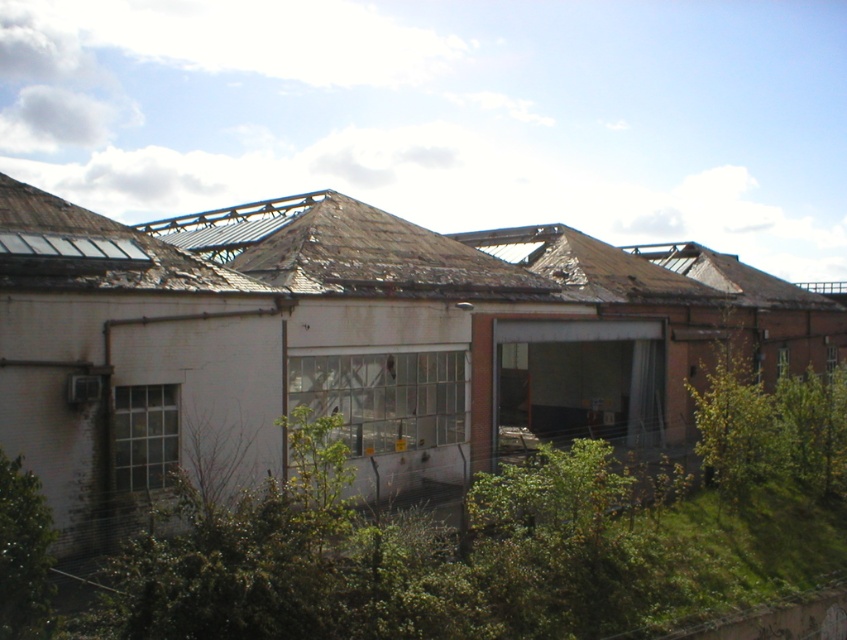
You are a drone operator trying to map the exterior of this industrial building. You have two points marked on your screen corresponding to coordinates in the image. The first point is at location point (662, 465) and the second is at point (225, 250). Which point is closer to the camera based on their positions in the image?

Point (225, 250) is closer to the camera because it is positioned in front of point (662, 465), which is further away.

Consider the image. You are a gardener tasked with trimming plants in the industrial complex. You have a 1.5 meter wide pathway between the green leafy shrub at center and the green leafy bush at lower left. Can you safely pass through this pathway with your 1.2 meter wide gardening cart?

The green leafy shrub at center is wider than the green leafy bush at lower left. Since the pathway between them is 1.5 meters wide, and your cart is 1.2 meters wide, there is enough space for the cart to pass safely as long as you stay centered in the path.

You are a maintenance worker assessing the building. You notice the weathered brown roof at upper center and the green leafy bush at lower left. Which object is positioned higher in the image?

The weathered brown roof at upper center is positioned higher than the green leafy bush at lower left.